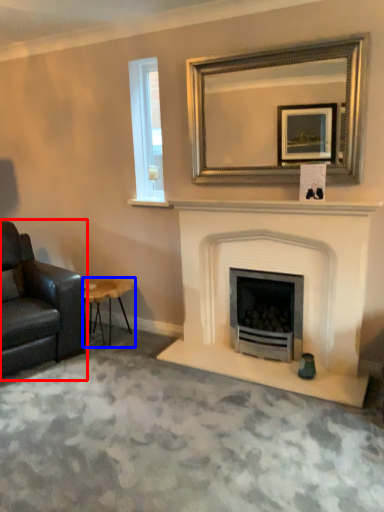
Question: Which of the following is the farthest to the observer, chair (highlighted by a red box) or stool (highlighted by a blue box)?

Choices:
 (A) chair
 (B) stool

Answer: (B)